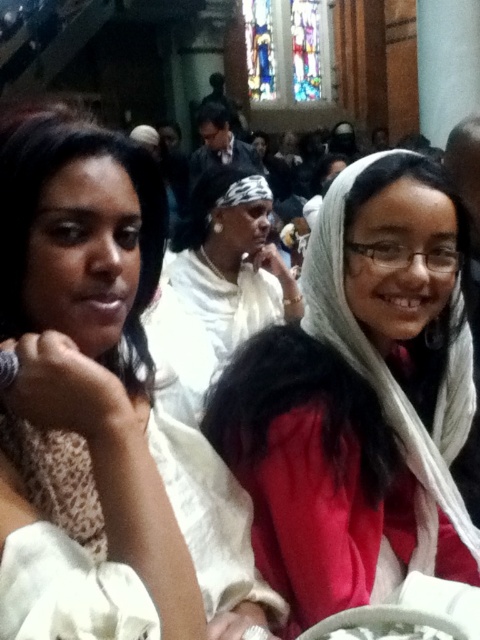
Question: Can you confirm if white fabric scarf at center is bigger than white fabric headscarf at center?

Choices:
 (A) yes
 (B) no

Answer: (B)

Question: Does white fabric scarf at center have a greater width compared to red matte scarf at center?

Choices:
 (A) yes
 (B) no

Answer: (B)

Question: Which of the following is the closest to the observer?

Choices:
 (A) red matte scarf at center
 (B) white fabric headscarf at center

Answer: (A)

Question: Which object appears farthest from the camera in this image?

Choices:
 (A) red matte scarf at center
 (B) white fabric headscarf at center

Answer: (B)

Question: Which is nearer to the white fabric scarf at center?

Choices:
 (A) white fabric headscarf at center
 (B) red matte scarf at center

Answer: (B)

Question: Does red matte scarf at center have a larger size compared to white fabric headscarf at center?

Choices:
 (A) yes
 (B) no

Answer: (B)